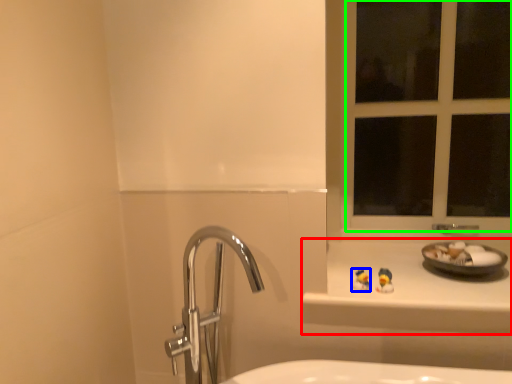
Question: Which object is the farthest from counter top (highlighted by a red box)? Choose among these: miniature (highlighted by a blue box) or window frame (highlighted by a green box).

Choices:
 (A) miniature
 (B) window frame

Answer: (B)